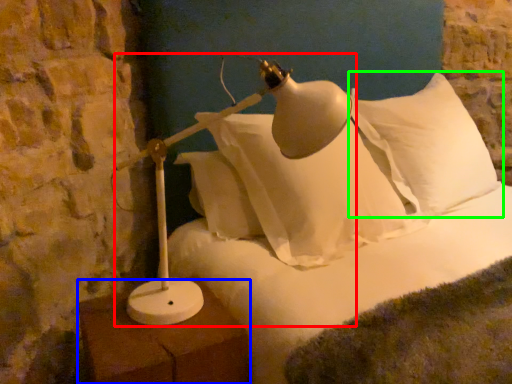
Question: Estimate the real-world distances between objects in this image. Which object is closer to lamp (highlighted by a red box), furniture (highlighted by a blue box) or pillow (highlighted by a green box)?

Choices:
 (A) furniture
 (B) pillow

Answer: (A)